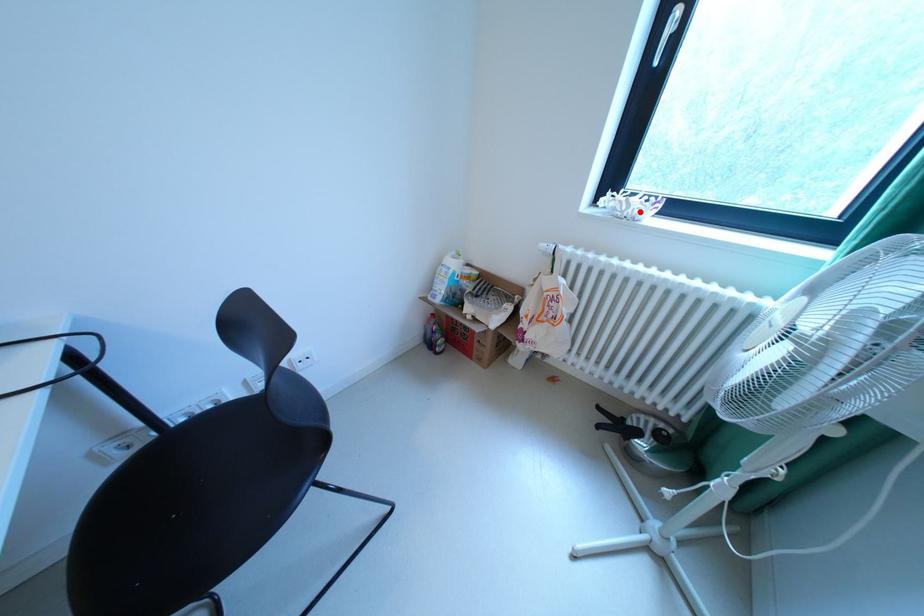
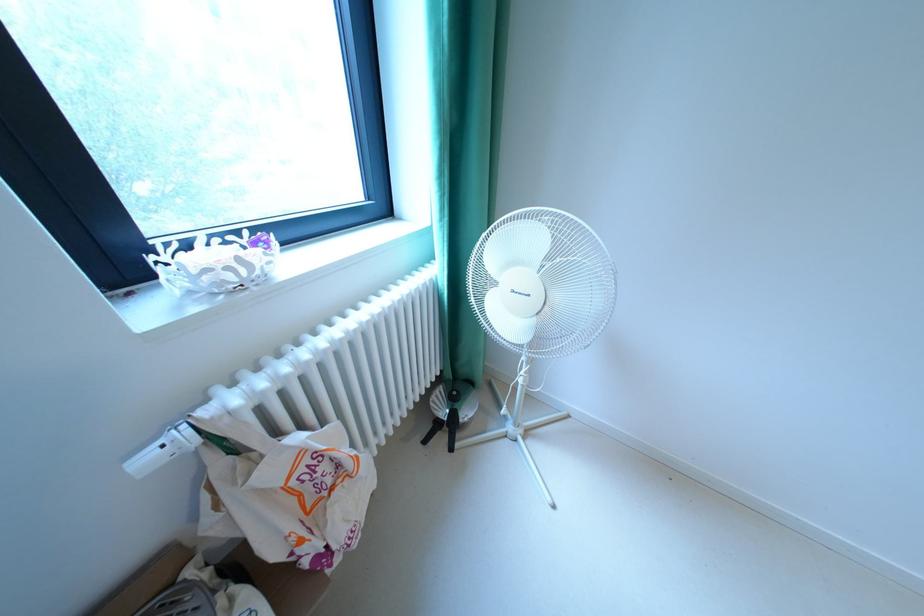
In the second image, find the point that corresponds to the highlighted location in the first image.

(268, 273)